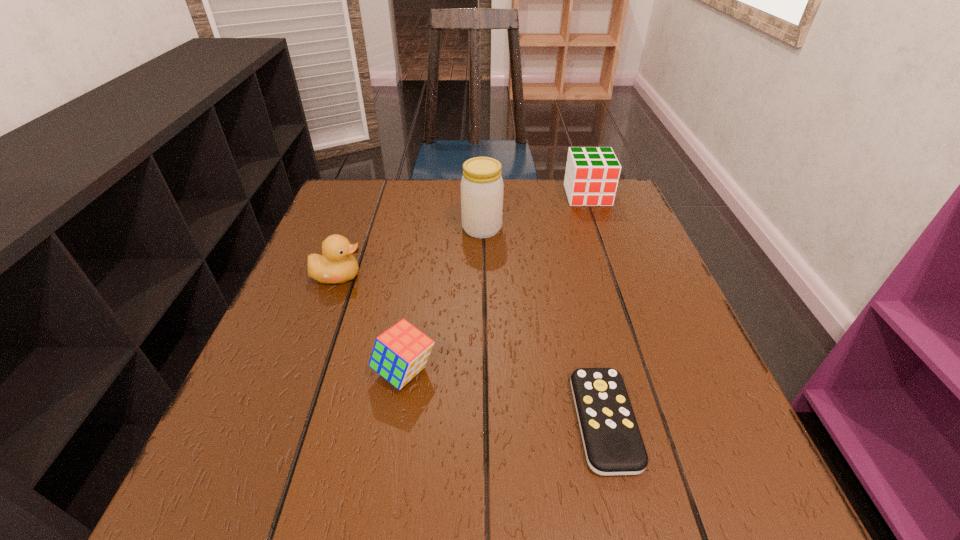
The height and width of the screenshot is (540, 960). Find the location of `object positioned at the far right corner`. object positioned at the far right corner is located at coordinates (591, 179).

Find the location of `object that is at the near right corner`. object that is at the near right corner is located at coordinates (613, 445).

Image resolution: width=960 pixels, height=540 pixels. I want to click on blank area at the near edge, so click(x=541, y=484).

At what (x,y) coordinates should I click in order to perform the action: click on vacant space at the left edge of the desktop. Please return your answer as a coordinate pair (x, y). The image size is (960, 540). Looking at the image, I should click on (314, 252).

In the image, there is a desktop. At what (x,y) coordinates should I click in order to perform the action: click on vacant space at the right edge. Please return your answer as a coordinate pair (x, y). This screenshot has width=960, height=540. Looking at the image, I should click on (588, 269).

This screenshot has width=960, height=540. What are the coordinates of `vacant space at the far left corner` in the screenshot? It's located at (371, 188).

Find the location of a particular element. The image size is (960, 540). free space at the near left corner of the desktop is located at coordinates (225, 470).

In the image, there is a desktop. Where is `vacant space at the far right corner`? vacant space at the far right corner is located at coordinates (608, 226).

You are a GUI agent. You are given a task and a screenshot of the screen. Output one action in this format:
    pyautogui.click(x=<x>, y=<y>)
    Task: Click on the free region at the near right corner of the desktop
    The height and width of the screenshot is (540, 960).
    Given the screenshot: What is the action you would take?
    pyautogui.click(x=681, y=472)

This screenshot has width=960, height=540. In order to click on empty space between the fourth nearest object and the nearer cube in this screenshot , I will do `click(444, 300)`.